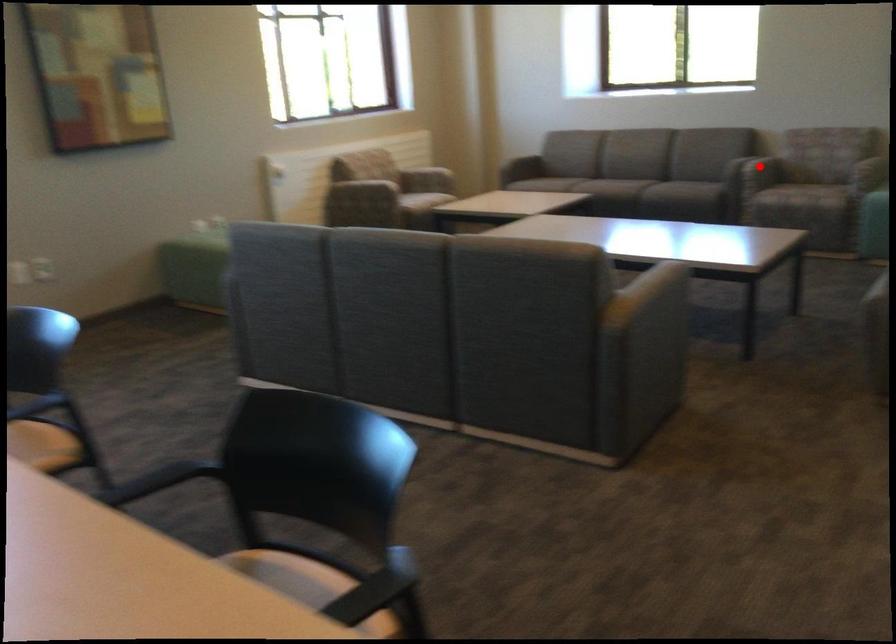
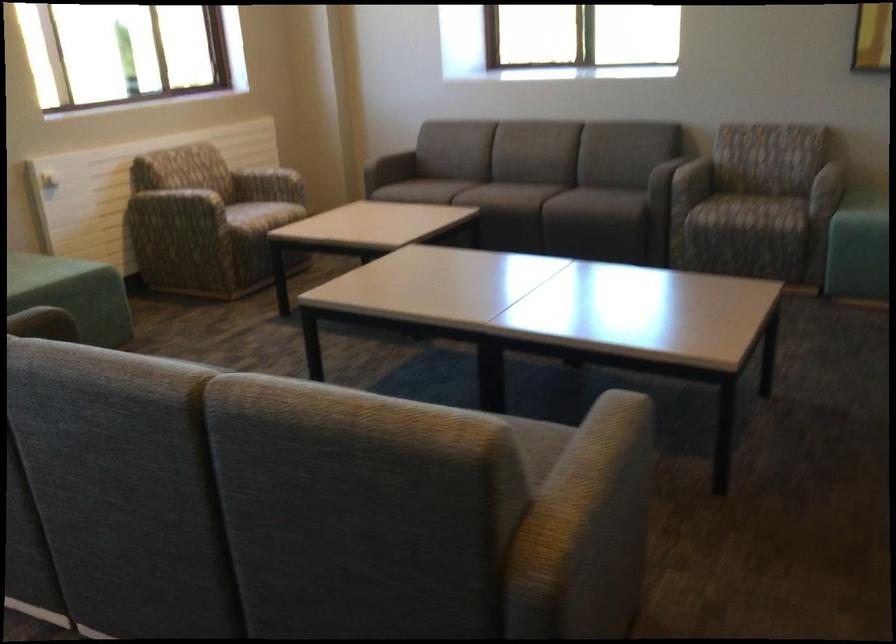
Question: I am providing you with two images of the same scene from different viewpoints. A red point is shown in image1. For the corresponding object point in image2, is it positioned nearer or farther from the camera?

Choices:
 (A) Nearer
 (B) Farther

Answer: (A)